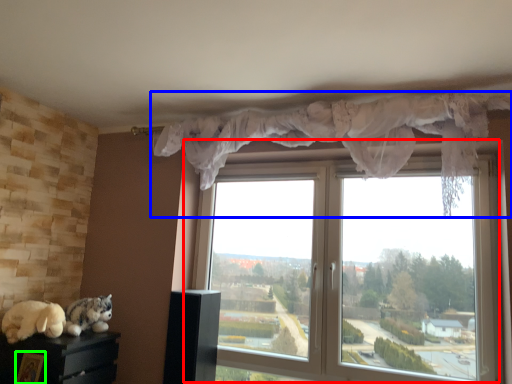
Question: Which is nearer to the window (highlighted by a red box)? curtain (highlighted by a blue box) or picture frame (highlighted by a green box).

Choices:
 (A) curtain
 (B) picture frame

Answer: (A)